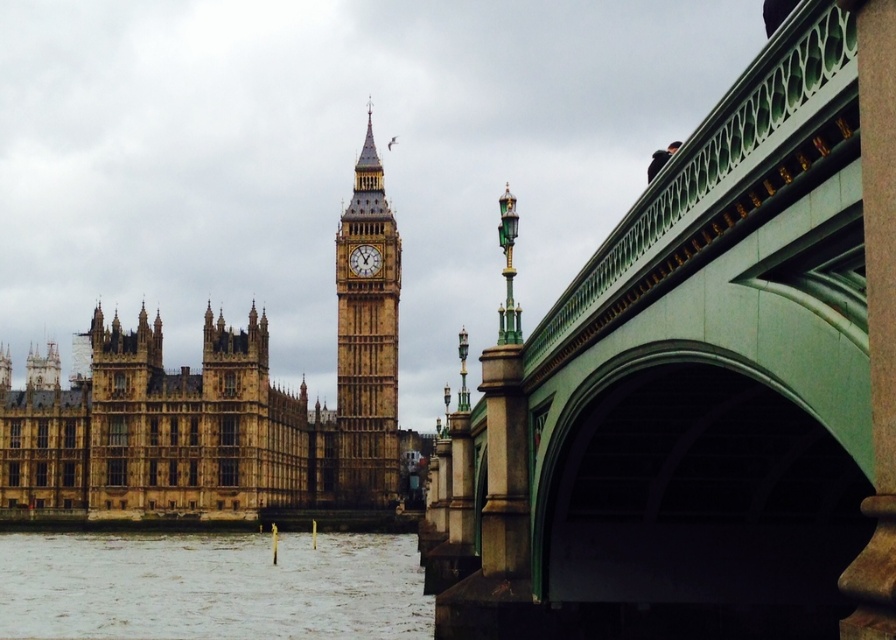
The height and width of the screenshot is (640, 896). In order to click on brown stone building at left in this screenshot , I will do `click(156, 429)`.

Can you confirm if brown stone building at left is bigger than gray water at lower left?

Yes.

Who is more forward, (x=214, y=520) or (x=283, y=541)?

Point (x=214, y=520)

Locate an element on the screen. Image resolution: width=896 pixels, height=640 pixels. brown stone building at left is located at coordinates (156, 429).

Looking at this image, is green stone bridge at upper right to the left of brown stone clock tower at center from the viewer's perspective?

Answer: Incorrect, green stone bridge at upper right is not on the left side of brown stone clock tower at center.

Is point (851, 524) positioned before point (367, 376)?

Yes, point (851, 524) is closer to viewer.

At what (x,y) coordinates should I click in order to perform the action: click on green stone bridge at upper right. Please return your answer as a coordinate pair (x, y). Looking at the image, I should click on (703, 385).

Between brown stone building at center and brown stone building at left, which one has less height?

brown stone building at left is shorter.

What do you see at coordinates (214, 410) in the screenshot? I see `brown stone building at center` at bounding box center [214, 410].

You are a GUI agent. You are given a task and a screenshot of the screen. Output one action in this format:
    pyautogui.click(x=<x>, y=<y>)
    Task: Click on the brown stone building at center
    
    Given the screenshot: What is the action you would take?
    pyautogui.click(x=214, y=410)